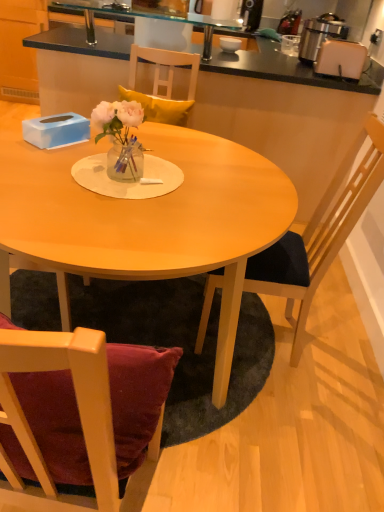
At what (x,y) coordinates should I click in order to perform the action: click on empty space that is to the right of wooden chair at right. Please return your answer as a coordinate pair (x, y). The height and width of the screenshot is (512, 384). Looking at the image, I should click on tap(347, 351).